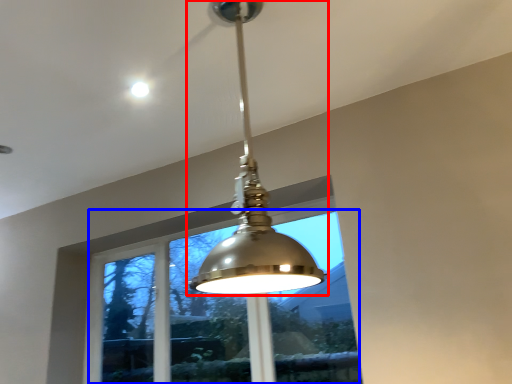
Question: Which object appears farthest to the camera in this image, lamp (highlighted by a red box) or window (highlighted by a blue box)?

Choices:
 (A) lamp
 (B) window

Answer: (B)